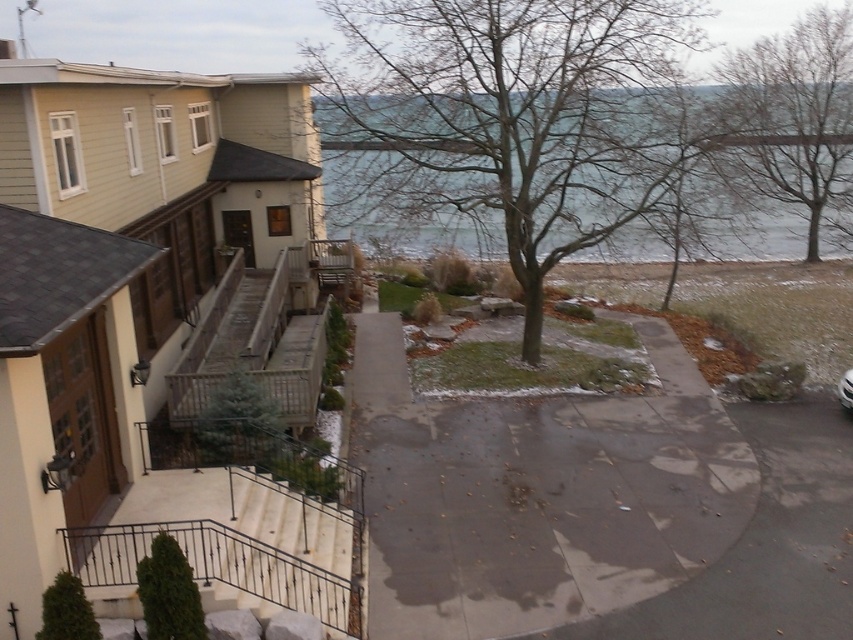
Does point (671, 134) come behind point (234, 435)?

Yes, it is.

Which is above, clear water at upper center or green matte tree at center?

clear water at upper center

Who is more forward, (x=386, y=163) or (x=248, y=416)?

Positioned in front is point (x=248, y=416).

You are a GUI agent. You are given a task and a screenshot of the screen. Output one action in this format:
    pyautogui.click(x=<x>, y=<y>)
    Task: Click on the clear water at upper center
    
    Given the screenshot: What is the action you would take?
    pyautogui.click(x=718, y=166)

Does clear water at upper center have a lesser width compared to green matte evergreen tree at lower left?

No, clear water at upper center is not thinner than green matte evergreen tree at lower left.

Does clear water at upper center lie behind green matte evergreen tree at lower left?

That is True.

Which is behind, point (523, 250) or point (158, 625)?

The point (523, 250) is behind.

Where is `clear water at upper center`? Image resolution: width=853 pixels, height=640 pixels. clear water at upper center is located at coordinates (718, 166).

Does point (318, 532) come closer to viewer compared to point (86, 620)?

No.

Consider the image. Who is more forward, (253,516) or (65,624)?

Point (65,624) is more forward.

Find the location of a particular element. Image resolution: width=853 pixels, height=640 pixels. white stone stairs at lower left is located at coordinates (281, 547).